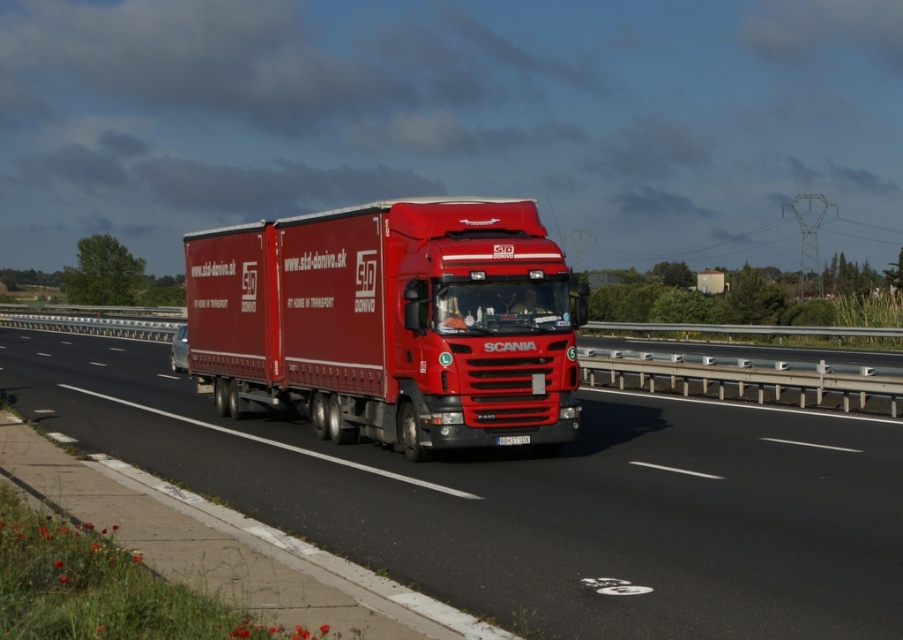
Question: Which point is farther to the camera?

Choices:
 (A) matte red truck at center
 (B) white plastic license plate at center

Answer: (B)

Question: Is matte red truck at center thinner than matte red trailer truck at center?

Choices:
 (A) yes
 (B) no

Answer: (B)

Question: Can you confirm if matte red truck at center is bigger than white plastic license plate at center?

Choices:
 (A) no
 (B) yes

Answer: (B)

Question: Which is nearer to the matte red trailer truck at center?

Choices:
 (A) white plastic license plate at center
 (B) matte red truck at center

Answer: (B)

Question: Can you confirm if matte red truck at center is wider than white plastic license plate at center?

Choices:
 (A) no
 (B) yes

Answer: (B)

Question: Which is nearer to the white plastic license plate at center?

Choices:
 (A) matte red trailer truck at center
 (B) matte red truck at center

Answer: (A)